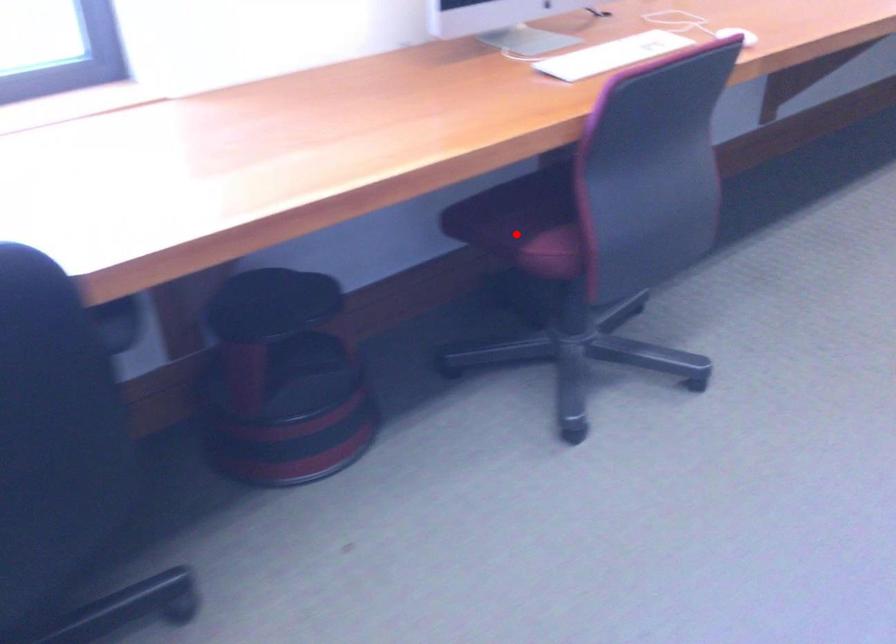
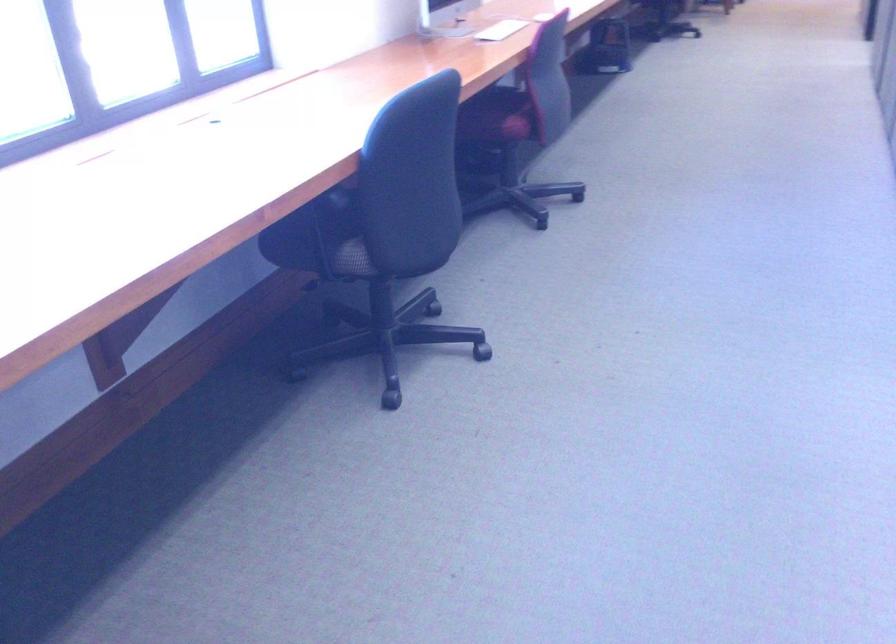
Question: A red point is marked in image1. In image2, is the corresponding 3D point closer to the camera or farther? Reply with the corresponding letter.

Choices:
 (A) The corresponding 3D point is closer.
 (B) The corresponding 3D point is farther.

Answer: (B)